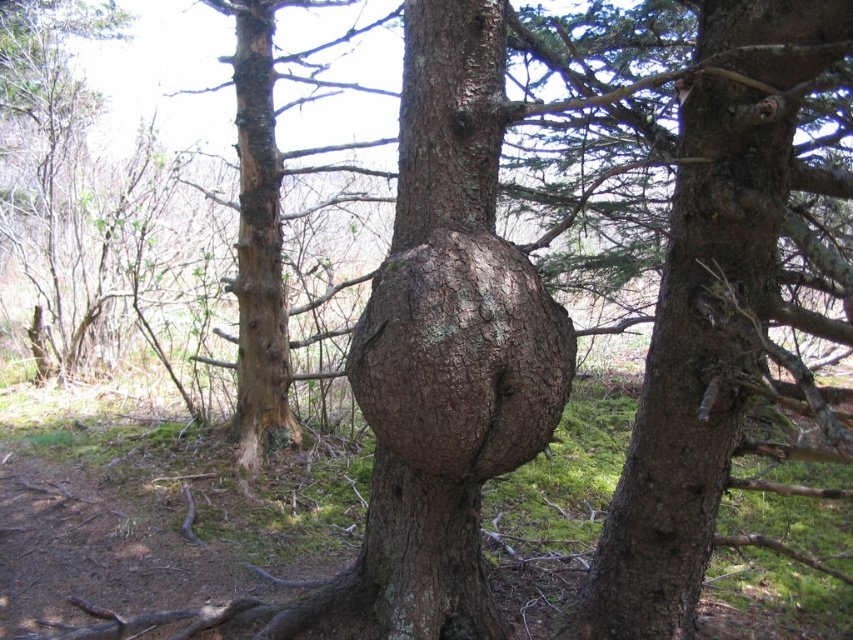
You are a hiker in the forest and want to identify the tree with the largest trunk width between the brown rough bark at center and the brown rough bark tree trunk at left. Which tree should you choose?

The brown rough bark at center has a larger width than the brown rough bark tree trunk at left, so you should choose the brown rough bark at center.